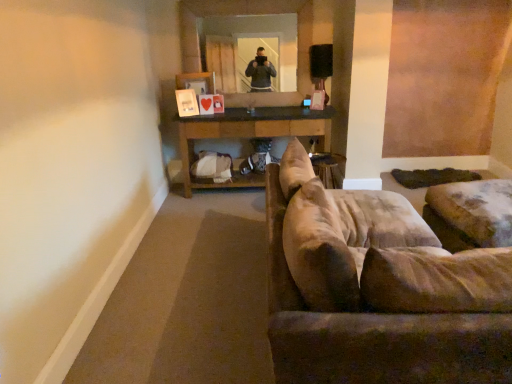
Question: From a real-world perspective, is brown wooden table at center beneath suede-like beige couch at right?

Choices:
 (A) no
 (B) yes

Answer: (B)

Question: From a real-world perspective, is brown wooden table at center positioned over suede-like beige couch at right based on gravity?

Choices:
 (A) no
 (B) yes

Answer: (A)

Question: From the image's perspective, would you say brown wooden table at center is positioned over suede-like beige couch at right?

Choices:
 (A) yes
 (B) no

Answer: (A)

Question: Considering the relative sizes of brown wooden table at center and suede-like beige couch at right in the image provided, is brown wooden table at center taller than suede-like beige couch at right?

Choices:
 (A) no
 (B) yes

Answer: (A)

Question: Is the depth of brown wooden table at center greater than that of suede-like beige couch at right?

Choices:
 (A) no
 (B) yes

Answer: (B)

Question: Is brown wooden table at center aimed at suede-like beige couch at right?

Choices:
 (A) no
 (B) yes

Answer: (B)

Question: From a real-world perspective, is clear glass mirror at upper center below suede-like beige couch at right?

Choices:
 (A) yes
 (B) no

Answer: (B)

Question: Is clear glass mirror at upper center touching suede-like beige couch at right?

Choices:
 (A) yes
 (B) no

Answer: (B)

Question: Is suede-like beige couch at right located within clear glass mirror at upper center?

Choices:
 (A) yes
 (B) no

Answer: (B)

Question: Is clear glass mirror at upper center looking in the opposite direction of suede-like beige couch at right?

Choices:
 (A) no
 (B) yes

Answer: (A)

Question: From a real-world perspective, is clear glass mirror at upper center physically above suede-like beige couch at right?

Choices:
 (A) no
 (B) yes

Answer: (B)

Question: Is clear glass mirror at upper center not inside suede-like beige couch at right?

Choices:
 (A) yes
 (B) no

Answer: (A)

Question: Is brown wooden table at center turned away from clear glass mirror at upper center?

Choices:
 (A) yes
 (B) no

Answer: (B)